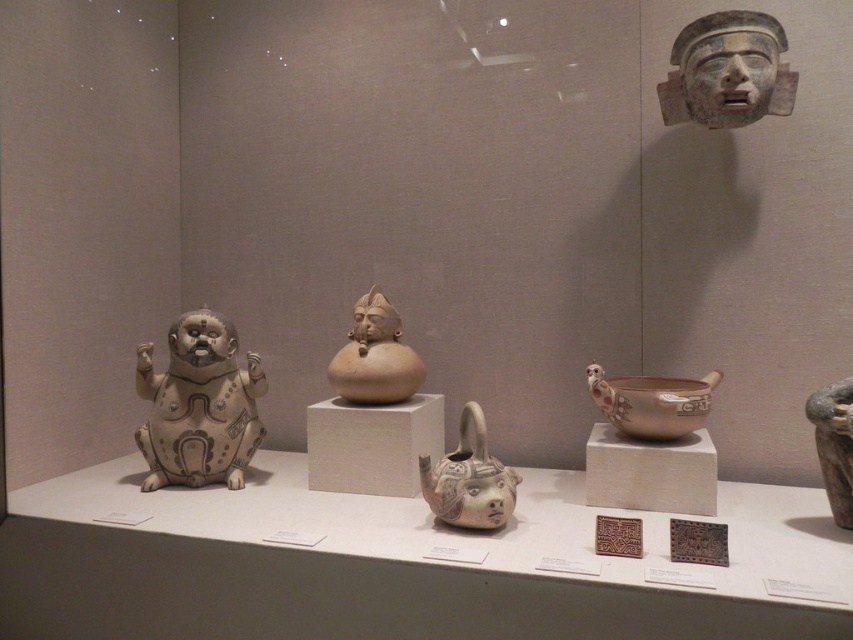
Question: Is white matte figurine at left bigger than matte clay figure at center?

Choices:
 (A) yes
 (B) no

Answer: (A)

Question: Does gray stone mask at upper right appear under brown matte vase at right?

Choices:
 (A) no
 (B) yes

Answer: (A)

Question: Which point is closer to the camera?

Choices:
 (A) (380, 308)
 (B) (437, 513)

Answer: (B)

Question: Can you confirm if white matte figurine at left is positioned above brown matte vase at right?

Choices:
 (A) no
 (B) yes

Answer: (B)

Question: Which of these objects is positioned closest to the white matte figurine at left?

Choices:
 (A) brown matte vase at right
 (B) gray stone mask at upper right
 (C) matte clay teapot at center

Answer: (C)

Question: Which object appears farthest from the camera in this image?

Choices:
 (A) white matte figurine at left
 (B) matte clay teapot at center
 (C) matte clay figure at center

Answer: (A)